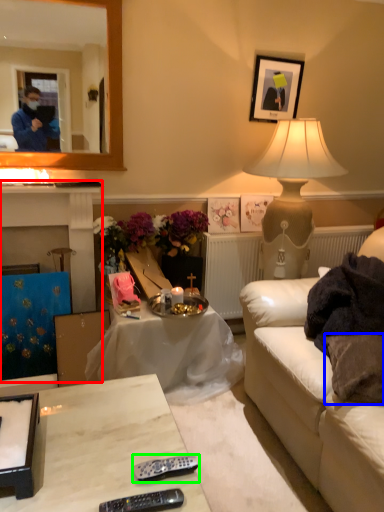
Question: Estimate the real-world distances between objects in this image. Which object is closer to fireplace (highlighted by a red box), pillow (highlighted by a blue box) or remote (highlighted by a green box)?

Choices:
 (A) pillow
 (B) remote

Answer: (B)